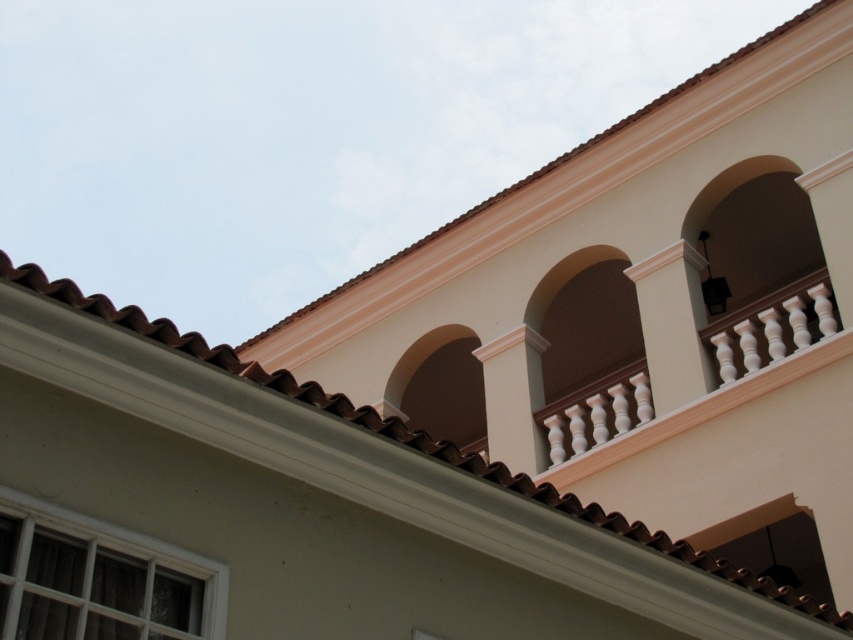
You are an architect inspecting the building and want to measure the distance between the white smooth pillar at upper center and the white glossy column at upper center. Which one is nearer to you?

The white smooth pillar at upper center is closer to the viewer than the white glossy column at upper center.

You are standing at the base of the building and want to take a photo of the white smooth pillar at upper center. Considering the distance, will you need a zoom lens to capture it clearly?

The white smooth pillar at upper center is 25.01 meters from the camera. Since this distance is quite far, using a zoom lens would be necessary to capture the pillar clearly.

You are an architect inspecting the building. You notice two columns supporting the arches at the upper center. Which one is taller between the white smooth pillar at upper center and the white glossy column at upper center?

The white smooth pillar at upper center is much taller than the white glossy column at upper center according to the description.